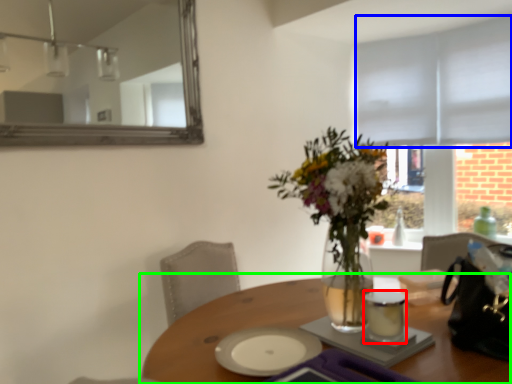
Question: Which is farther away from tableware (highlighted by a red box)? blind (highlighted by a blue box) or table (highlighted by a green box)?

Choices:
 (A) blind
 (B) table

Answer: (A)